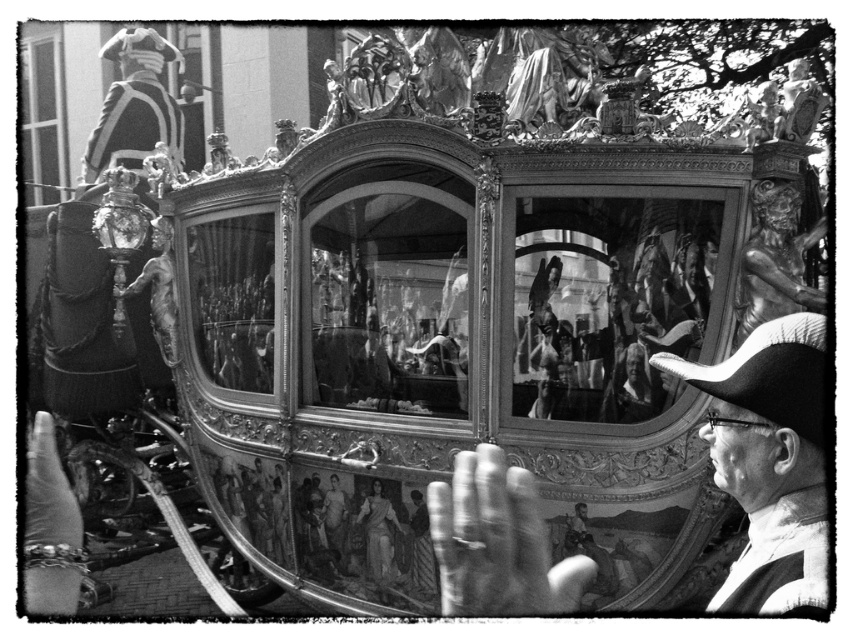
Question: Is smooth black hat at right above smooth white statue at center?

Choices:
 (A) no
 (B) yes

Answer: (B)

Question: Does smooth leather hat at center appear on the right side of smooth black hat at right?

Choices:
 (A) no
 (B) yes

Answer: (A)

Question: Is the position of smooth leather hat at center more distant than that of smooth black hat at right?

Choices:
 (A) no
 (B) yes

Answer: (A)

Question: Among these points, which one is farthest from the camera?

Choices:
 (A) (386, 544)
 (B) (711, 435)
 (C) (462, 547)

Answer: (A)

Question: Which of the following is the closest to the observer?

Choices:
 (A) (741, 484)
 (B) (381, 573)
 (C) (737, 365)

Answer: (C)

Question: Among these points, which one is farthest from the camera?

Choices:
 (A) (804, 428)
 (B) (367, 548)

Answer: (B)